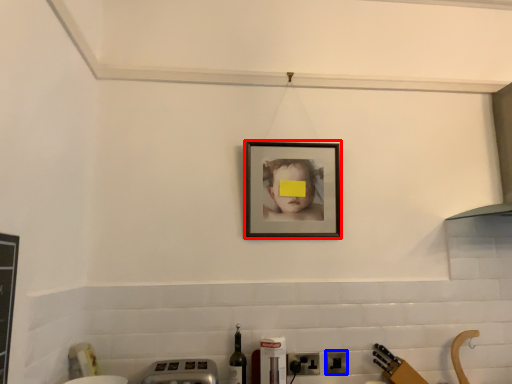
Question: Which of the following is the closest to the observer, picture frame (highlighted by a red box) or electric outlet (highlighted by a blue box)?

Choices:
 (A) picture frame
 (B) electric outlet

Answer: (B)